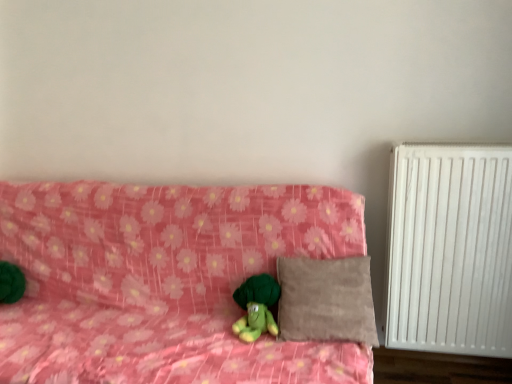
What do you see at coordinates (256, 307) in the screenshot? This screenshot has width=512, height=384. I see `green plush toy at center` at bounding box center [256, 307].

This screenshot has height=384, width=512. In order to click on beige suede pillow at center in this screenshot , I will do `click(326, 300)`.

Describe the element at coordinates (450, 249) in the screenshot. I see `white matte radiator at right` at that location.

Identify the location of pink floral fabric couch at center. This screenshot has height=384, width=512. (164, 281).

The height and width of the screenshot is (384, 512). Find the location of `green plush toy at center`. green plush toy at center is located at coordinates (256, 307).

Is beige suede pillow at center oriented towards green plush toy at center?

No, beige suede pillow at center is not aimed at green plush toy at center.

Considering the sizes of beige suede pillow at center and green plush toy at center in the image, is beige suede pillow at center wider or thinner than green plush toy at center?

In the image, beige suede pillow at center appears to be wider than green plush toy at center.

Is beige suede pillow at center positioned beyond the bounds of green plush toy at center?

That's correct, beige suede pillow at center is outside of green plush toy at center.

Considering the relative sizes of beige suede pillow at center and green plush toy at center in the image provided, is beige suede pillow at center taller than green plush toy at center?

Yes.

Is point (258, 317) in front of point (239, 369)?

No, (258, 317) is behind (239, 369).

Is green plush toy at center to the left or to the right of pink floral fabric couch at center in the image?

From the image, it's evident that green plush toy at center is to the right of pink floral fabric couch at center.

Would you say green plush toy at center contains pink floral fabric couch at center?

No, pink floral fabric couch at center is located outside of green plush toy at center.

Are white matte radiator at right and pink floral fabric couch at center making contact?

No, white matte radiator at right is not making contact with pink floral fabric couch at center.

Looking at this image, which object is further away from the camera taking this photo, white matte radiator at right or pink floral fabric couch at center?

white matte radiator at right is behind.

Looking at their sizes, would you say white matte radiator at right is wider or thinner than pink floral fabric couch at center?

In the image, white matte radiator at right appears to be more narrow than pink floral fabric couch at center.

Could you tell me if white matte radiator at right is facing pink floral fabric couch at center?

No, white matte radiator at right is not facing towards pink floral fabric couch at center.

Is pink floral fabric couch at center positioned before white matte radiator at right?

Yes, pink floral fabric couch at center is closer to the viewer.

Looking at this image, considering the sizes of objects pink floral fabric couch at center and white matte radiator at right in the image provided, who is taller, pink floral fabric couch at center or white matte radiator at right?

With more height is white matte radiator at right.

From the image's perspective, who appears lower, pink floral fabric couch at center or white matte radiator at right?

pink floral fabric couch at center, from the image's perspective.

Is pink floral fabric couch at center far from white matte radiator at right?

That's not correct — pink floral fabric couch at center is a little close to white matte radiator at right.

From a real-world perspective, between white matte radiator at right and beige suede pillow at center, who is vertically higher?

white matte radiator at right is physically above.

Locate an element on the screen. pillow below the white matte radiator at right (from a real-world perspective) is located at coordinates (x=326, y=300).

Is point (433, 333) positioned behind point (327, 269)?

Yes, it is.

Considering the sizes of white matte radiator at right and beige suede pillow at center in the image, is white matte radiator at right wider or thinner than beige suede pillow at center?

Clearly, white matte radiator at right has less width compared to beige suede pillow at center.

In terms of height, does pink floral fabric couch at center look taller or shorter compared to green plush toy at center?

Clearly, pink floral fabric couch at center is taller compared to green plush toy at center.

Is pink floral fabric couch at center oriented towards green plush toy at center?

Yes, pink floral fabric couch at center faces towards green plush toy at center.

Which is behind, point (232, 260) or point (236, 331)?

Positioned behind is point (232, 260).

Identify the location of furniture in front of the beige suede pillow at center. (164, 281).

Measure the distance from pink floral fabric couch at center to beige suede pillow at center.

A distance of 13.31 inches exists between pink floral fabric couch at center and beige suede pillow at center.

Is pink floral fabric couch at center in front of beige suede pillow at center?

Yes, it is.

Is pink floral fabric couch at center to the right of beige suede pillow at center from the viewer's perspective?

No, pink floral fabric couch at center is not to the right of beige suede pillow at center.

You are a GUI agent. You are given a task and a screenshot of the screen. Output one action in this format:
    pyautogui.click(x=<x>, y=<y>)
    Task: Click on the toy directly beneath the beige suede pillow at center (from a real-world perspective)
    The width and height of the screenshot is (512, 384).
    Given the screenshot: What is the action you would take?
    pyautogui.click(x=256, y=307)

The width and height of the screenshot is (512, 384). I want to click on toy behind the pink floral fabric couch at center, so click(256, 307).

Looking at the image, which one is located closer to green plush toy at center, white matte radiator at right or beige suede pillow at center?

beige suede pillow at center is positioned closer to the anchor green plush toy at center.

Estimate the real-world distances between objects in this image. Which object is further from green plush toy at center, beige suede pillow at center or white matte radiator at right?

The object further to green plush toy at center is white matte radiator at right.

Which object lies further to the anchor point pink floral fabric couch at center, beige suede pillow at center or white matte radiator at right?

The object further to pink floral fabric couch at center is white matte radiator at right.

Looking at the image, which one is located further to pink floral fabric couch at center, beige suede pillow at center or green plush toy at center?

The object further to pink floral fabric couch at center is green plush toy at center.

Estimate the real-world distances between objects in this image. Which object is closer to beige suede pillow at center, pink floral fabric couch at center or green plush toy at center?

The object closer to beige suede pillow at center is green plush toy at center.

Which object lies further to the anchor point green plush toy at center, pink floral fabric couch at center or white matte radiator at right?

white matte radiator at right lies further to green plush toy at center than the other object.

Which object lies further to the anchor point beige suede pillow at center, pink floral fabric couch at center or white matte radiator at right?

white matte radiator at right is further to beige suede pillow at center.

Looking at the image, which one is located further to white matte radiator at right, green plush toy at center or beige suede pillow at center?

green plush toy at center is further to white matte radiator at right.

At what (x,y) coordinates should I click in order to perform the action: click on pillow between pink floral fabric couch at center and white matte radiator at right from left to right. Please return your answer as a coordinate pair (x, y). The height and width of the screenshot is (384, 512). Looking at the image, I should click on (326, 300).

You are a GUI agent. You are given a task and a screenshot of the screen. Output one action in this format:
    pyautogui.click(x=<x>, y=<y>)
    Task: Click on the pillow between green plush toy at center and white matte radiator at right in the horizontal direction
    This screenshot has width=512, height=384.
    Given the screenshot: What is the action you would take?
    pyautogui.click(x=326, y=300)

Find the location of a particular element. The image size is (512, 384). toy situated between pink floral fabric couch at center and white matte radiator at right from left to right is located at coordinates (256, 307).

Identify the location of toy between pink floral fabric couch at center and beige suede pillow at center from left to right. This screenshot has width=512, height=384. (256, 307).